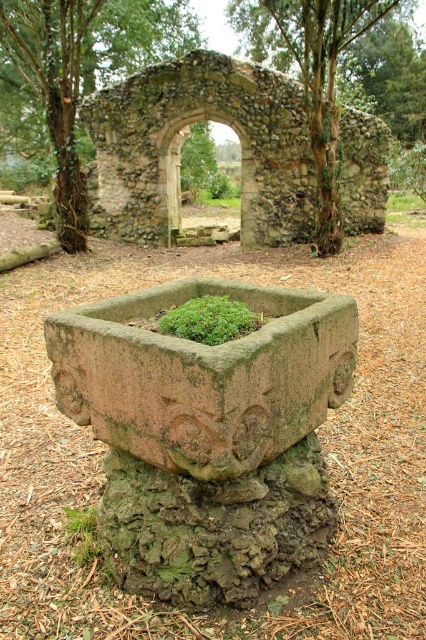
Who is more forward, (78,17) or (330,221)?

Point (78,17)

Is green mossy stone at center thinner than green mossy stone arch at center?

Yes, green mossy stone at center is thinner than green mossy stone arch at center.

Describe the element at coordinates (80, 72) in the screenshot. The image size is (426, 640). I see `green mossy stone at center` at that location.

The image size is (426, 640). In order to click on green mossy stone at center in this screenshot , I will do `click(80, 72)`.